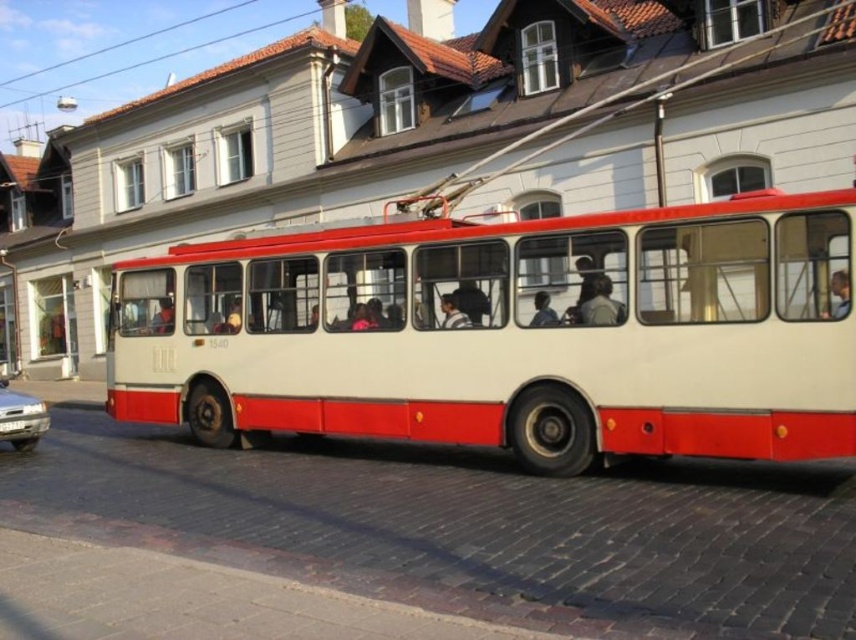
Question: Which object appears farthest from the camera in this image?

Choices:
 (A) smooth beige jacket at center
 (B) matte black head at center
 (C) matte plastic head at center

Answer: (C)

Question: Is silver metallic car at lower left to the left of smooth skin face at center from the viewer's perspective?

Choices:
 (A) yes
 (B) no

Answer: (A)

Question: Which object appears closest to the camera in this image?

Choices:
 (A) matte plastic head at center
 (B) silver metallic car at lower left
 (C) white matte bus at center

Answer: (C)

Question: Does matte plastic head at center appear on the right side of matte black head at center?

Choices:
 (A) yes
 (B) no

Answer: (B)

Question: Among these points, which one is nearest to the camera?

Choices:
 (A) (825, 312)
 (B) (611, 298)
 (C) (777, 321)

Answer: (A)

Question: Is white matte bus at center further to camera compared to matte plastic head at center?

Choices:
 (A) yes
 (B) no

Answer: (B)